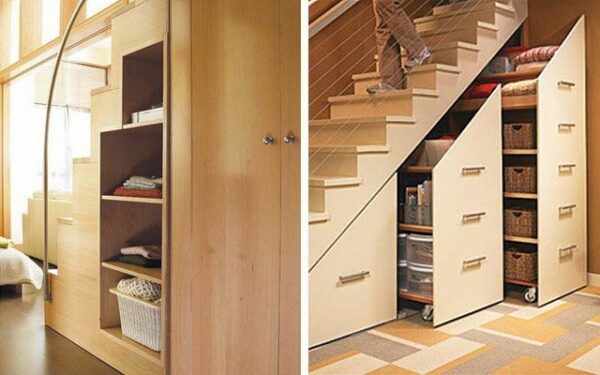
The width and height of the screenshot is (600, 375). I want to click on wood floor, so click(37, 348).